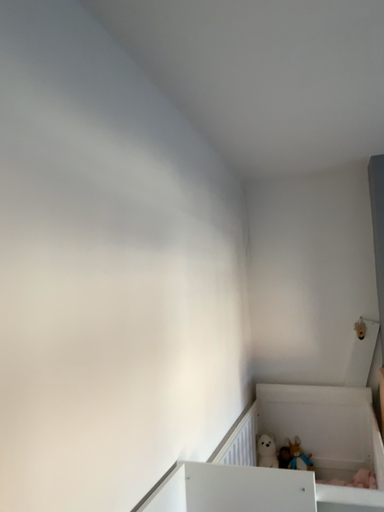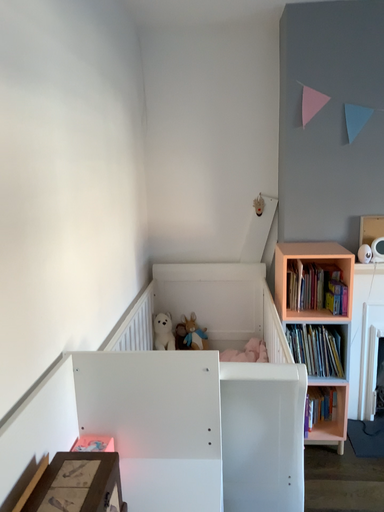
Question: How did the camera likely rotate when shooting the video?

Choices:
 (A) rotated right
 (B) rotated left

Answer: (A)